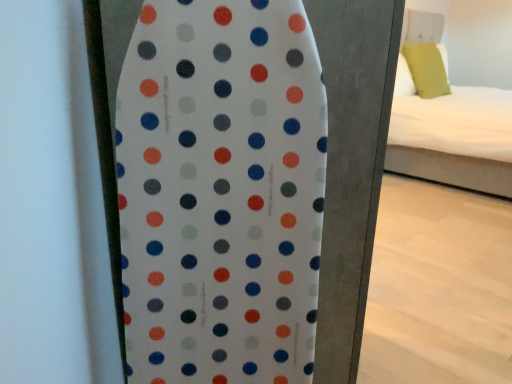
Question: In terms of width, does white fabric bed at right look wider or thinner when compared to white dotted surfboard at center?

Choices:
 (A) thin
 (B) wide

Answer: (B)

Question: Is point (446, 127) positioned closer to the camera than point (253, 201)?

Choices:
 (A) closer
 (B) farther

Answer: (B)

Question: Considering the real-world distances, which object is closest to the white dotted surfboard at center?

Choices:
 (A) white fabric bed at right
 (B) green fabric pillow at upper right

Answer: (A)

Question: Considering the real-world distances, which object is closest to the green fabric pillow at upper right?

Choices:
 (A) white fabric bed at right
 (B) white dotted surfboard at center

Answer: (A)